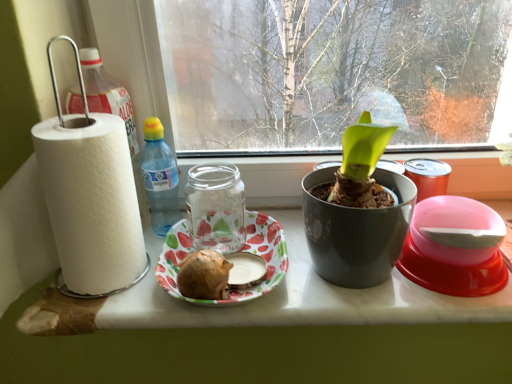
Question: Is transparent glass jar at center wider than white paper at left?

Choices:
 (A) no
 (B) yes

Answer: (A)

Question: Does transparent glass jar at center lie in front of white paper at left?

Choices:
 (A) no
 (B) yes

Answer: (A)

Question: From the image's perspective, is transparent glass jar at center located above white paper at left?

Choices:
 (A) no
 (B) yes

Answer: (A)

Question: Is transparent glass jar at center smaller than white paper at left?

Choices:
 (A) yes
 (B) no

Answer: (A)

Question: Considering the relative positions of transparent glass jar at center and white paper at left in the image provided, is transparent glass jar at center to the right of white paper at left from the viewer's perspective?

Choices:
 (A) no
 (B) yes

Answer: (B)

Question: Considering the positions of white paper at left and brown matte potato at center in the image, is white paper at left bigger or smaller than brown matte potato at center?

Choices:
 (A) big
 (B) small

Answer: (A)

Question: From the image's perspective, is white paper at left positioned above or below brown matte potato at center?

Choices:
 (A) below
 (B) above

Answer: (B)

Question: From a real-world perspective, is white paper at left positioned above or below brown matte potato at center?

Choices:
 (A) below
 (B) above

Answer: (B)

Question: Relative to brown matte potato at center, is white paper at left in front or behind?

Choices:
 (A) front
 (B) behind

Answer: (A)

Question: Would you say translucent plastic bottle at center is to the left or to the right of transparent glass jar at center in the picture?

Choices:
 (A) left
 (B) right

Answer: (A)

Question: From a real-world perspective, is translucent plastic bottle at center above or below transparent glass jar at center?

Choices:
 (A) below
 (B) above

Answer: (B)

Question: Does point (172, 165) appear closer or farther from the camera than point (218, 205)?

Choices:
 (A) closer
 (B) farther

Answer: (A)

Question: Is translucent plastic bottle at center inside the boundaries of transparent glass jar at center, or outside?

Choices:
 (A) inside
 (B) outside

Answer: (B)

Question: From a real-world perspective, is transparent glass jar at center physically located above or below brown matte potato at center?

Choices:
 (A) below
 (B) above

Answer: (B)

Question: Is transparent glass jar at center inside the boundaries of brown matte potato at center, or outside?

Choices:
 (A) outside
 (B) inside

Answer: (A)